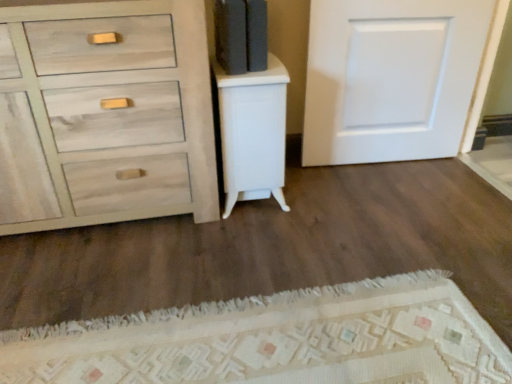
Question: Is white glossy cabinet at center thinner than white matte door at upper right?

Choices:
 (A) no
 (B) yes

Answer: (A)

Question: Does white glossy cabinet at center appear on the right side of white matte door at upper right?

Choices:
 (A) yes
 (B) no

Answer: (B)

Question: Could you tell me if white glossy cabinet at center is turned towards white matte door at upper right?

Choices:
 (A) yes
 (B) no

Answer: (B)

Question: Is white glossy cabinet at center far from white matte door at upper right?

Choices:
 (A) no
 (B) yes

Answer: (A)

Question: From the image's perspective, is white glossy cabinet at center below white matte door at upper right?

Choices:
 (A) yes
 (B) no

Answer: (A)

Question: Is white glossy cabinet at center positioned before white matte door at upper right?

Choices:
 (A) no
 (B) yes

Answer: (B)

Question: Can you confirm if light gray wood dresser at left is shorter than white matte door at upper right?

Choices:
 (A) no
 (B) yes

Answer: (A)

Question: Is light gray wood dresser at left touching white matte door at upper right?

Choices:
 (A) yes
 (B) no

Answer: (B)

Question: Is white matte door at upper right inside light gray wood dresser at left?

Choices:
 (A) no
 (B) yes

Answer: (A)

Question: Can you confirm if light gray wood dresser at left is positioned to the left of white matte door at upper right?

Choices:
 (A) yes
 (B) no

Answer: (A)

Question: Can you confirm if light gray wood dresser at left is smaller than white matte door at upper right?

Choices:
 (A) yes
 (B) no

Answer: (B)

Question: Is there a large distance between light gray wood dresser at left and white matte door at upper right?

Choices:
 (A) no
 (B) yes

Answer: (A)

Question: Does white matte door at upper right come behind white glossy cabinet at center?

Choices:
 (A) yes
 (B) no

Answer: (A)